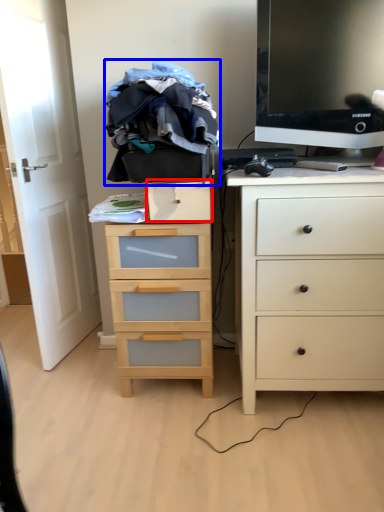
Question: Among these objects, which one is farthest to the camera, drawer (highlighted by a red box) or clothing (highlighted by a blue box)?

Choices:
 (A) drawer
 (B) clothing

Answer: (A)